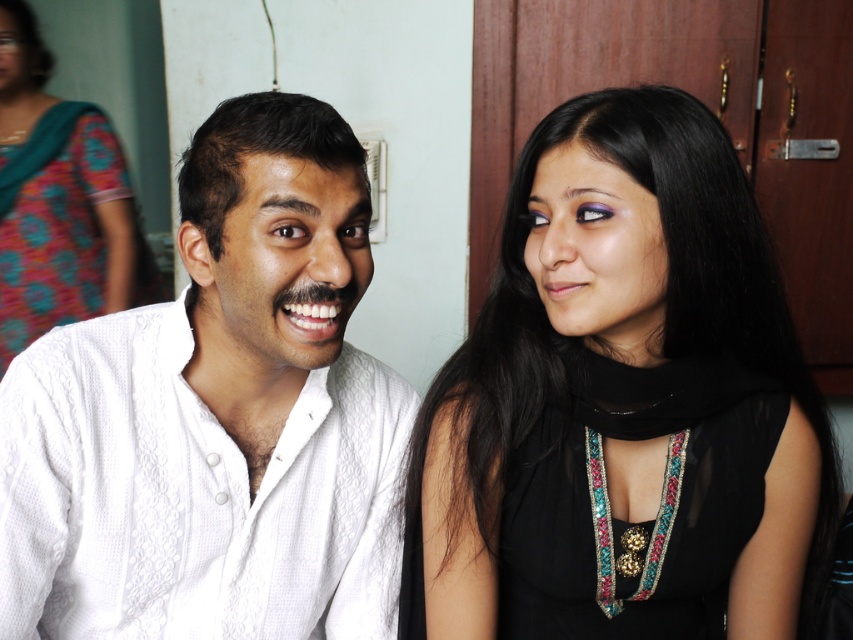
Between point (160, 625) and point (79, 124), which one is positioned in front?

Point (160, 625) is more forward.

Is white textured shirt at left shorter than teal floral sari at upper left?

Yes.

Which is in front, point (257, 376) or point (25, 268)?

Positioned in front is point (257, 376).

Where is `white textured shirt at left`? white textured shirt at left is located at coordinates (218, 417).

Describe the element at coordinates (624, 403) in the screenshot. I see `black satin dress at center` at that location.

Does point (589, 352) come behind point (140, 586)?

Yes.

Is point (704, 616) closer to camera compared to point (357, 268)?

No, (704, 616) is further to viewer.

At what (x,y) coordinates should I click in order to perform the action: click on black satin dress at center. Please return your answer as a coordinate pair (x, y). This screenshot has width=853, height=640. Looking at the image, I should click on pyautogui.click(x=624, y=403).

Is black satin dress at center bigger than teal floral sari at upper left?

No.

Does point (686, 330) come in front of point (103, 225)?

Yes, point (686, 330) is closer to viewer.

Between point (689, 323) and point (33, 166), which one is positioned in front?

Point (689, 323)

You are a GUI agent. You are given a task and a screenshot of the screen. Output one action in this format:
    pyautogui.click(x=<x>, y=<y>)
    Task: Click on the black satin dress at center
    
    Given the screenshot: What is the action you would take?
    pyautogui.click(x=624, y=403)